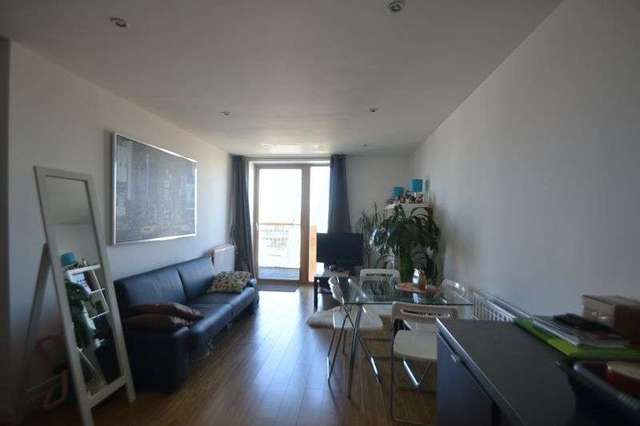
Locate an element on the screen. The height and width of the screenshot is (426, 640). tv is located at coordinates (x=326, y=249).